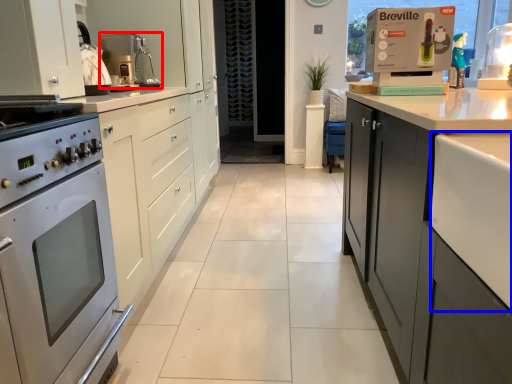
Question: Which point is further to the camera, kitchen appliance (highlighted by a red box) or counter top (highlighted by a blue box)?

Choices:
 (A) kitchen appliance
 (B) counter top

Answer: (A)